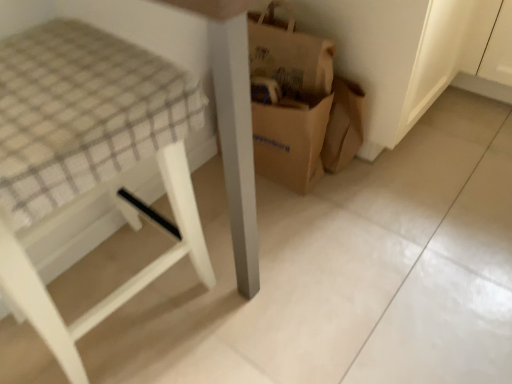
Locate an element on the screen. The height and width of the screenshot is (384, 512). white wood stool at left is located at coordinates (88, 159).

Describe the element at coordinates (88, 159) in the screenshot. The width and height of the screenshot is (512, 384). I see `white wood stool at left` at that location.

Image resolution: width=512 pixels, height=384 pixels. Find the location of `white wood stool at left`. white wood stool at left is located at coordinates (88, 159).